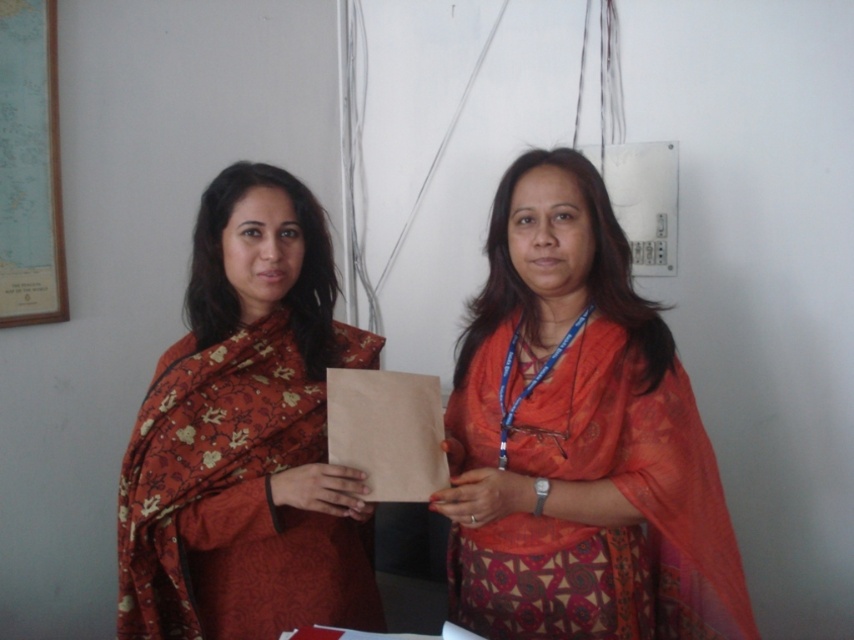
Does point (560, 269) lie in front of point (261, 531)?

No.

Locate an element on the screen. This screenshot has width=854, height=640. matte orange sari at center is located at coordinates (578, 438).